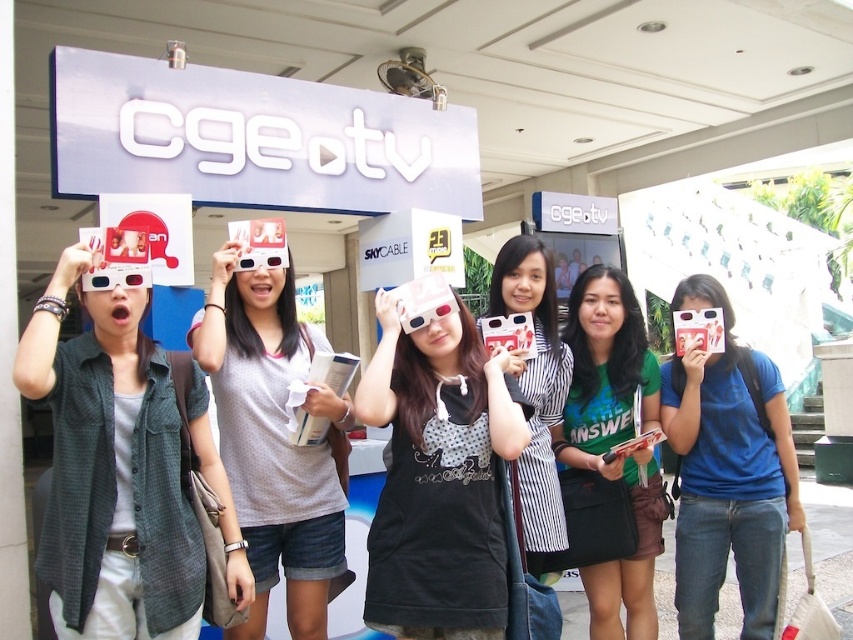
Question: Can you confirm if green checkered shirt at left is positioned below green matte shirt at center?

Choices:
 (A) yes
 (B) no

Answer: (B)

Question: Which object appears farthest from the camera in this image?

Choices:
 (A) white matte tank top at center
 (B) green matte shirt at center
 (C) matte black dress at center
 (D) green checkered shirt at left

Answer: (B)

Question: Is the position of white matte tank top at center less distant than that of green matte shirt at center?

Choices:
 (A) no
 (B) yes

Answer: (B)

Question: Estimate the real-world distances between objects in this image. Which object is farther from the green checkered shirt at left?

Choices:
 (A) green matte shirt at center
 (B) white matte tank top at center
 (C) striped fabric dress at center

Answer: (A)

Question: Which point is closer to the camera?

Choices:
 (A) (148, 488)
 (B) (756, 451)

Answer: (A)

Question: Is blue cotton shirt at center positioned in front of striped fabric dress at center?

Choices:
 (A) yes
 (B) no

Answer: (B)